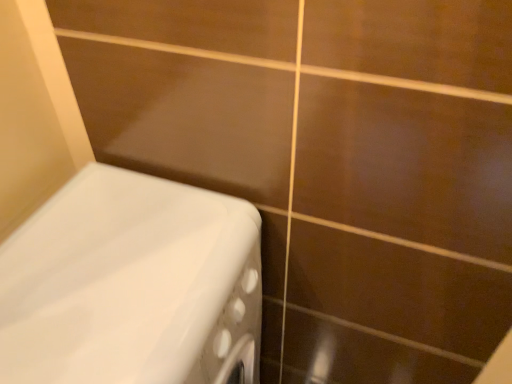
At what (x,y) coordinates should I click in order to perform the action: click on white glossy sink at lower left. Please return your answer as a coordinate pair (x, y). Looking at the image, I should click on [132, 285].

Describe the element at coordinates (132, 285) in the screenshot. Image resolution: width=512 pixels, height=384 pixels. I see `white glossy sink at lower left` at that location.

This screenshot has height=384, width=512. I want to click on white glossy sink at lower left, so click(132, 285).